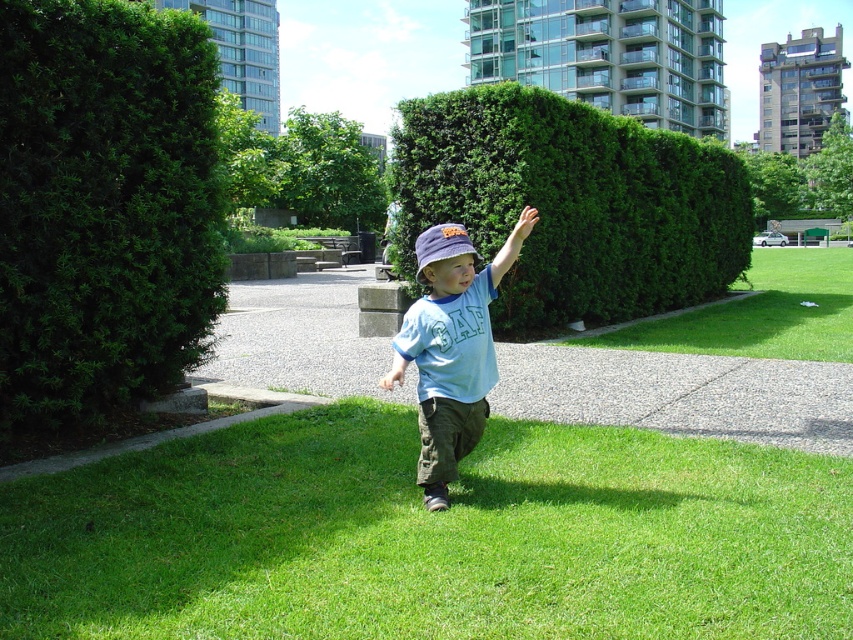
Question: Which object appears farthest from the camera in this image?

Choices:
 (A) light blue cotton shirt at center
 (B) purple fabric baseball hat at center

Answer: (B)

Question: In this image, where is green grass at center located relative to purple fabric baseball hat at center?

Choices:
 (A) left
 (B) right

Answer: (B)

Question: Is green leafy hedge at upper center positioned before purple fabric baseball hat at center?

Choices:
 (A) yes
 (B) no

Answer: (B)

Question: Does green grass at center have a larger size compared to green leafy bush at left?

Choices:
 (A) yes
 (B) no

Answer: (B)

Question: Which object appears closest to the camera in this image?

Choices:
 (A) green grass at center
 (B) light blue cotton shirt at center
 (C) green leafy bush at left
 (D) green leafy hedge at upper center

Answer: (A)

Question: Which object appears farthest from the camera in this image?

Choices:
 (A) green leafy hedge at upper center
 (B) green leafy bush at left
 (C) green grass at center

Answer: (A)